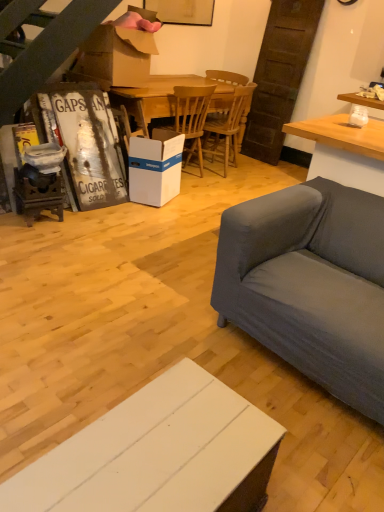
What do you see at coordinates (225, 124) in the screenshot? I see `wooden chair at center, which is the first chair from right to left` at bounding box center [225, 124].

Locate an element on the screen. This screenshot has width=384, height=512. wooden table at center is located at coordinates (167, 97).

In order to face white wood cabinet at lower center, should I rotate leftwards or rightwards?

It's best to rotate left around 5.396 degrees.

The image size is (384, 512). What do you see at coordinates (158, 454) in the screenshot?
I see `white wood cabinet at lower center` at bounding box center [158, 454].

In order to click on brown cardboard box at upper center in this screenshot , I will do `click(114, 57)`.

From the image's perspective, between wooden table at center and wooden chair at center, which is the first chair from right to left, who is located below?

wooden chair at center, which is the first chair from right to left, appears lower in the image.

Considering the positions of objects wooden table at center and wooden chair at center, which is the first chair from right to left, in the image provided, who is in front, wooden table at center or wooden chair at center, which is the first chair from right to left,?

wooden table at center is in front.

From a real-world perspective, is wooden table at center positioned above or below wooden chair at center, which is the 2th chair in left-to-right order?

wooden table at center is situated lower than wooden chair at center, which is the 2th chair in left-to-right order, in the real world.

Are wooden table at center and wooden chair at center, which is the first chair from right to left, far apart?

No, wooden table at center is not far from wooden chair at center, which is the first chair from right to left.

Is wooden at center, which is the second chair in right-to-left order, taller or shorter than wooden table at center?

Considering their sizes, wooden at center, which is the second chair in right-to-left order, has more height than wooden table at center.

From the image's perspective, between wooden at center, which is the second chair in right-to-left order, and wooden table at center, which one is located above?

wooden table at center appears higher in the image.

Looking at this image, considering the relative sizes of wooden at center, positioned as the 1th chair in left-to-right order, and wooden table at center in the image provided, is wooden at center, positioned as the 1th chair in left-to-right order, bigger than wooden table at center?

Incorrect, wooden at center, positioned as the 1th chair in left-to-right order, is not larger than wooden table at center.

How many degrees apart are the facing directions of brown cardboard box at upper center and white wood cabinet at lower center?

0.000603 degrees separate the facing orientations of brown cardboard box at upper center and white wood cabinet at lower center.

Based on the photo, based on their sizes in the image, would you say brown cardboard box at upper center is bigger or smaller than white wood cabinet at lower center?

brown cardboard box at upper center is bigger than white wood cabinet at lower center.

Is brown cardboard box at upper center touching white wood cabinet at lower center?

No, brown cardboard box at upper center is not making contact with white wood cabinet at lower center.

The height and width of the screenshot is (512, 384). In order to click on cabinetry that is on the right side of brown cardboard box at upper center in this screenshot , I will do coord(158,454).

Is point (139, 68) more distant than point (133, 153)?

That is True.

Do you think brown cardboard box at upper center is within white cardboard box at center, or outside of it?

brown cardboard box at upper center is located beyond the bounds of white cardboard box at center.

Between brown cardboard box at upper center and white cardboard box at center, which one has larger size?

Bigger between the two is brown cardboard box at upper center.

Considering the positions of points (102, 470) and (152, 95), is point (102, 470) closer to camera compared to point (152, 95)?

Yes.

How different are the orientations of white wood cabinet at lower center and wooden table at center in degrees?

The angular difference between white wood cabinet at lower center and wooden table at center is 0.659 degrees.

Is white wood cabinet at lower center positioned far away from wooden table at center?

That's right, there is a large distance between white wood cabinet at lower center and wooden table at center.

Relative to wooden table at center, is white wood cabinet at lower center in front or behind?

white wood cabinet at lower center is in front of wooden table at center.

In terms of width, does wooden chair at center, which is the 2th chair in left-to-right order, look wider or thinner when compared to white wood cabinet at lower center?

wooden chair at center, which is the 2th chair in left-to-right order, is wider than white wood cabinet at lower center.

Considering the relative sizes of wooden chair at center, which is the 2th chair in left-to-right order, and white wood cabinet at lower center in the image provided, is wooden chair at center, which is the 2th chair in left-to-right order, taller than white wood cabinet at lower center?

Correct, wooden chair at center, which is the 2th chair in left-to-right order, is much taller as white wood cabinet at lower center.

Is wooden chair at center, which is the first chair from right to left, oriented towards white wood cabinet at lower center?

No.

Considering the relative sizes of wooden chair at center, which is the 2th chair in left-to-right order, and wooden at center, positioned as the 1th chair in left-to-right order, in the image provided, is wooden chair at center, which is the 2th chair in left-to-right order, bigger than wooden at center, positioned as the 1th chair in left-to-right order,?

Indeed, wooden chair at center, which is the 2th chair in left-to-right order, has a larger size compared to wooden at center, positioned as the 1th chair in left-to-right order.

Is wooden chair at center, which is the first chair from right to left, positioned with its back to wooden at center, which is the second chair in right-to-left order?

That's not correct — wooden chair at center, which is the first chair from right to left, is not looking away from wooden at center, which is the second chair in right-to-left order.

Identify the location of chair behind the wooden at center, positioned as the 1th chair in left-to-right order. (225, 124).

From a real-world perspective, count 1st chairs upward from the wooden table at center and point to it. Please provide its 2D coordinates.

[(225, 124)]

Image resolution: width=384 pixels, height=512 pixels. What are the coordinates of `kitchen & dining room table lying above the wooden at center, positioned as the 1th chair in left-to-right order (from the image's perspective)` in the screenshot? It's located at (167, 97).

Estimate the real-world distances between objects in this image. Which object is closer to white wood cabinet at lower center, wooden table at center or wooden chair at center, which is the first chair from right to left?

wooden table at center is closer to white wood cabinet at lower center.

Estimate the real-world distances between objects in this image. Which object is further from brown cardboard box at upper center, white cardboard box at center or white wood cabinet at lower center?

Based on the image, white wood cabinet at lower center appears to be further to brown cardboard box at upper center.

Based on their spatial positions, is brown cardboard box at upper center or wooden table at center further from white cardboard box at center?

brown cardboard box at upper center is further to white cardboard box at center.

Looking at the image, which one is located closer to white wood cabinet at lower center, white cardboard box at center or brown cardboard box at upper center?

white cardboard box at center.

Estimate the real-world distances between objects in this image. Which object is further from wooden chair at center, which is the 2th chair in left-to-right order, white cardboard box at center or brown cardboard box at upper center?

The object further to wooden chair at center, which is the 2th chair in left-to-right order, is brown cardboard box at upper center.

When comparing their distances from wooden table at center, does white cardboard box at center or wooden chair at center, which is the first chair from right to left, seem further?

The object further to wooden table at center is white cardboard box at center.

Considering their positions, is wooden chair at center, which is the first chair from right to left, positioned closer to wooden at center, which is the second chair in right-to-left order, than wooden table at center?

The object closer to wooden at center, which is the second chair in right-to-left order, is wooden table at center.

Which object lies further to the anchor point brown cardboard box at upper center, wooden chair at center, which is the 2th chair in left-to-right order, or white cardboard box at center?

wooden chair at center, which is the 2th chair in left-to-right order.

The height and width of the screenshot is (512, 384). Identify the location of chair between white wood cabinet at lower center and wooden chair at center, which is the 2th chair in left-to-right order, along the z-axis. (191, 117).

At what (x,y) coordinates should I click in order to perform the action: click on cardboard box between white wood cabinet at lower center and wooden chair at center, which is the first chair from right to left, along the z-axis. Please return your answer as a coordinate pair (x, y). This screenshot has width=384, height=512. Looking at the image, I should click on (114, 57).

Find the location of a particular element. The image size is (384, 512). kitchen & dining room table between white cardboard box at center and wooden chair at center, which is the 2th chair in left-to-right order, from left to right is located at coordinates (167, 97).

The width and height of the screenshot is (384, 512). Find the location of `box positioned between white wood cabinet at lower center and wooden table at center from near to far`. box positioned between white wood cabinet at lower center and wooden table at center from near to far is located at coordinates (155, 167).